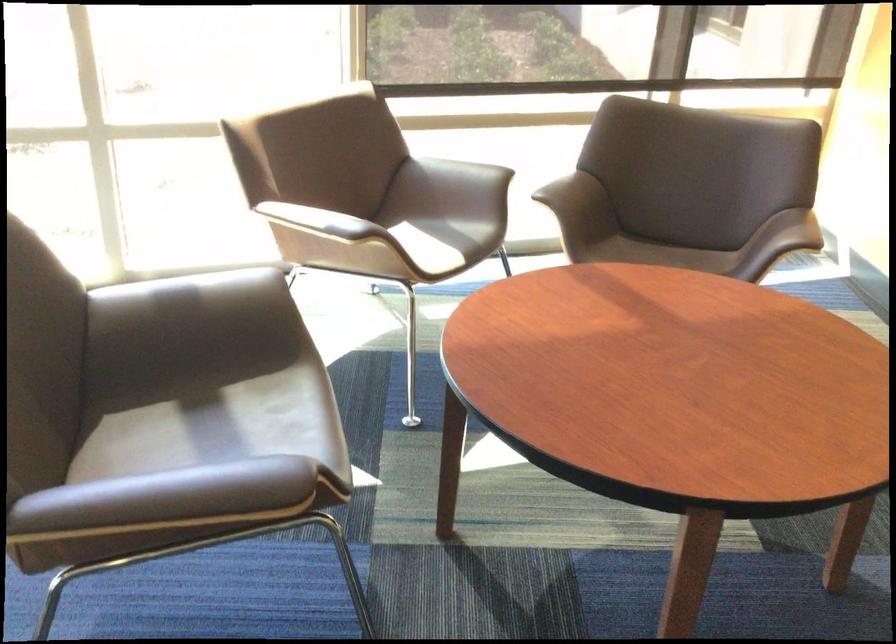
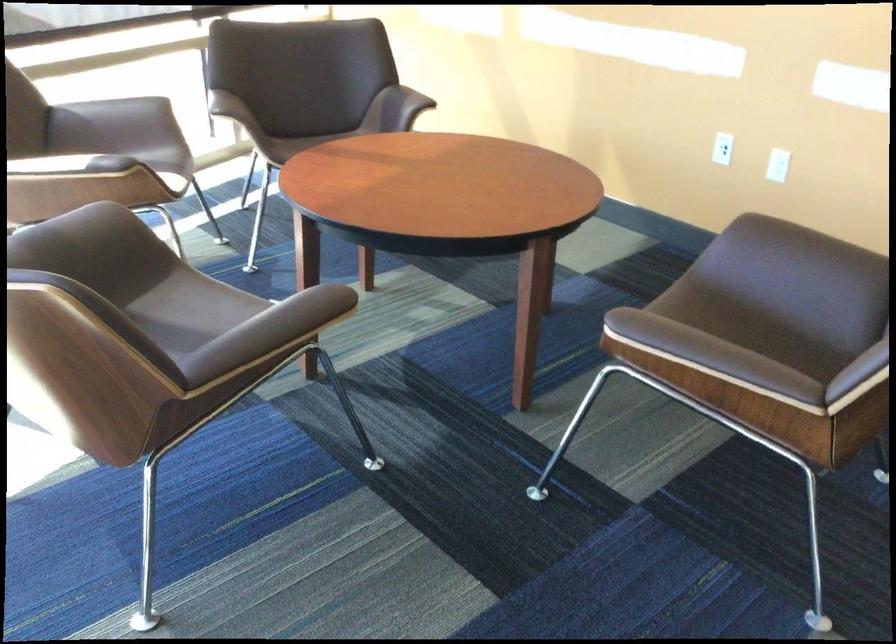
In the second image, find the point that corresponds to pixel 449 176 in the first image.

(115, 118)